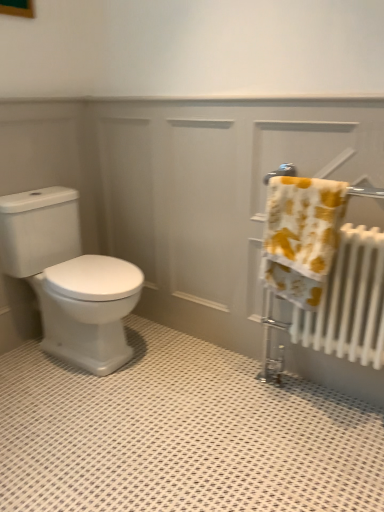
The image size is (384, 512). Describe the element at coordinates (301, 236) in the screenshot. I see `yellow printed towel at right` at that location.

In order to click on white glossy radiator at right in this screenshot , I will do `click(215, 191)`.

Would you consider white glossy radiator at right to be distant from yellow printed towel at right?

Actually, white glossy radiator at right and yellow printed towel at right are a little close together.

Consider the image. From the image's perspective, between white glossy radiator at right and yellow printed towel at right, which one is located above?

From the image's view, white glossy radiator at right is above.

Would you say yellow printed towel at right is part of white glossy radiator at right's contents?

Definitely not — yellow printed towel at right is not inside white glossy radiator at right.

Considering the sizes of objects white glossy radiator at right and yellow printed towel at right in the image provided, who is thinner, white glossy radiator at right or yellow printed towel at right?

Thinner between the two is white glossy radiator at right.

From the picture: Is the surface of yellow printed towel at right in direct contact with white glossy toilet at left?

They are not placed beside each other.

Considering the sizes of yellow printed towel at right and white glossy toilet at left in the image, is yellow printed towel at right bigger or smaller than white glossy toilet at left?

Considering their sizes, yellow printed towel at right takes up less space than white glossy toilet at left.

From the image's perspective, is yellow printed towel at right located above or below white glossy toilet at left?

yellow printed towel at right is above white glossy toilet at left.

How different are the orientations of yellow printed towel at right and white glossy toilet at left in degrees?

yellow printed towel at right and white glossy toilet at left are facing 88.5 degrees away from each other.

Is point (97, 308) closer or farther from the camera than point (338, 220)?

Point (97, 308).

From the image's perspective, which is above, white glossy toilet at left or yellow printed towel at right?

yellow printed towel at right appears higher in the image.

The image size is (384, 512). Identify the location of towel above the white glossy toilet at left (from the image's perspective). (301, 236).

Can you tell me how much white glossy toilet at left and yellow printed towel at right differ in facing direction?

The angle between the facing direction of white glossy toilet at left and the facing direction of yellow printed towel at right is 88.5 degrees.

From the image's perspective, which one is positioned higher, yellow printed towel at right or white glossy radiator at right?

white glossy radiator at right, from the image's perspective.

Considering the sizes of objects yellow printed towel at right and white glossy radiator at right in the image provided, who is taller, yellow printed towel at right or white glossy radiator at right?

white glossy radiator at right.

The width and height of the screenshot is (384, 512). Identify the location of screen door that is behind the yellow printed towel at right. (215, 191).

Is yellow printed towel at right at the right side of white glossy radiator at right?

Yes, yellow printed towel at right is to the right of white glossy radiator at right.

In the image, is white glossy toilet at left positioned in front of or behind white glossy radiator at right?

Visually, white glossy toilet at left is located behind white glossy radiator at right.

Which point is more distant from viewer, (x=17, y=266) or (x=144, y=185)?

The point (x=144, y=185) is more distant.

From a real-world perspective, is white glossy toilet at left physically below white glossy radiator at right?

Yes, from a real-world perspective, white glossy toilet at left is beneath white glossy radiator at right.

In the scene shown: From the image's perspective, would you say white glossy toilet at left is shown under white glossy radiator at right?

Yes.

Considering the positions of point (100, 220) and point (114, 304), is point (100, 220) closer or farther from the camera than point (114, 304)?

Point (100, 220).

Based on the photo, who is smaller, white glossy radiator at right or white glossy toilet at left?

white glossy radiator at right.

Is white glossy radiator at right spatially inside white glossy toilet at left, or outside of it?

white glossy radiator at right is not enclosed by white glossy toilet at left.

This screenshot has width=384, height=512. In order to click on screen door that is above the yellow printed towel at right (from the image's perspective) in this screenshot , I will do `click(215, 191)`.

Where is `towel that is on the right side of white glossy toilet at left`? Image resolution: width=384 pixels, height=512 pixels. towel that is on the right side of white glossy toilet at left is located at coordinates (301, 236).

Which object lies further to the anchor point white glossy toilet at left, yellow printed towel at right or white glossy radiator at right?

yellow printed towel at right.

Estimate the real-world distances between objects in this image. Which object is closer to white glossy radiator at right, yellow printed towel at right or white glossy toilet at left?

The object closer to white glossy radiator at right is yellow printed towel at right.

Estimate the real-world distances between objects in this image. Which object is further from yellow printed towel at right, white glossy radiator at right or white glossy toilet at left?

white glossy toilet at left is positioned further to the anchor yellow printed towel at right.

Looking at the image, which one is located further to yellow printed towel at right, white glossy toilet at left or white glossy radiator at right?

white glossy toilet at left is further to yellow printed towel at right.

Which object lies nearer to the anchor point white glossy radiator at right, white glossy toilet at left or yellow printed towel at right?

The object closer to white glossy radiator at right is yellow printed towel at right.

From the image, which object appears to be farther from white glossy toilet at left, white glossy radiator at right or yellow printed towel at right?

yellow printed towel at right is positioned further to the anchor white glossy toilet at left.

Find the location of `screen door located between white glossy toilet at left and yellow printed towel at right in the left-right direction`. screen door located between white glossy toilet at left and yellow printed towel at right in the left-right direction is located at coordinates (215, 191).